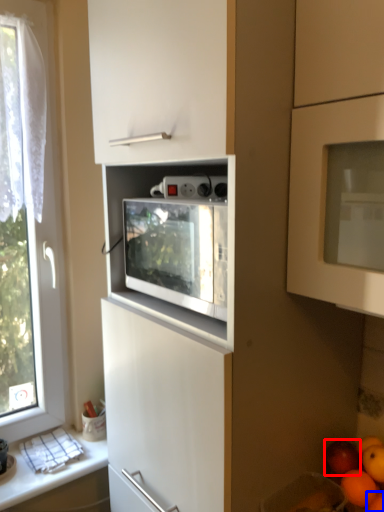
Question: Which of the following is the farthest to the observer, apple (highlighted by a red box) or orange (highlighted by a blue box)?

Choices:
 (A) apple
 (B) orange

Answer: (A)